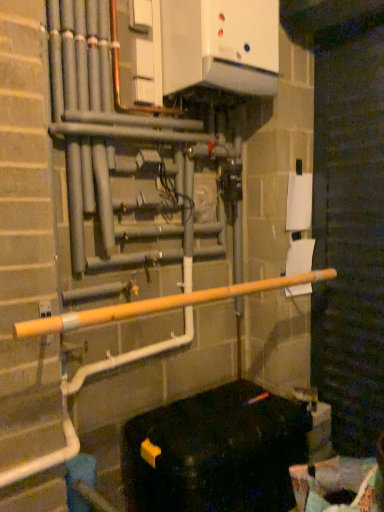
Question: Is recycled cardboard box at lower right taller than yellow matte pipe at center?

Choices:
 (A) yes
 (B) no

Answer: (A)

Question: Is recycled cardboard box at lower right in contact with yellow matte pipe at center?

Choices:
 (A) yes
 (B) no

Answer: (B)

Question: Is recycled cardboard box at lower right further to the viewer compared to yellow matte pipe at center?

Choices:
 (A) no
 (B) yes

Answer: (B)

Question: Does recycled cardboard box at lower right contain yellow matte pipe at center?

Choices:
 (A) no
 (B) yes

Answer: (A)

Question: From the image's perspective, is recycled cardboard box at lower right on top of yellow matte pipe at center?

Choices:
 (A) no
 (B) yes

Answer: (A)

Question: Is recycled cardboard box at lower right oriented away from yellow matte pipe at center?

Choices:
 (A) no
 (B) yes

Answer: (A)

Question: Is the depth of yellow matte pipe at center greater than that of recycled cardboard box at lower right?

Choices:
 (A) no
 (B) yes

Answer: (A)

Question: Considering the relative positions of yellow matte pipe at center and recycled cardboard box at lower right in the image provided, is yellow matte pipe at center to the left of recycled cardboard box at lower right from the viewer's perspective?

Choices:
 (A) yes
 (B) no

Answer: (A)

Question: Is yellow matte pipe at center facing away from recycled cardboard box at lower right?

Choices:
 (A) no
 (B) yes

Answer: (A)

Question: From a real-world perspective, is yellow matte pipe at center under recycled cardboard box at lower right?

Choices:
 (A) yes
 (B) no

Answer: (B)

Question: Could you tell me if yellow matte pipe at center is turned towards recycled cardboard box at lower right?

Choices:
 (A) no
 (B) yes

Answer: (A)

Question: Considering the relative sizes of yellow matte pipe at center and recycled cardboard box at lower right in the image provided, is yellow matte pipe at center shorter than recycled cardboard box at lower right?

Choices:
 (A) yes
 (B) no

Answer: (A)

Question: Considering the relative positions of recycled cardboard box at lower right and black plastic container at lower right in the image provided, is recycled cardboard box at lower right to the left of black plastic container at lower right from the viewer's perspective?

Choices:
 (A) yes
 (B) no

Answer: (B)